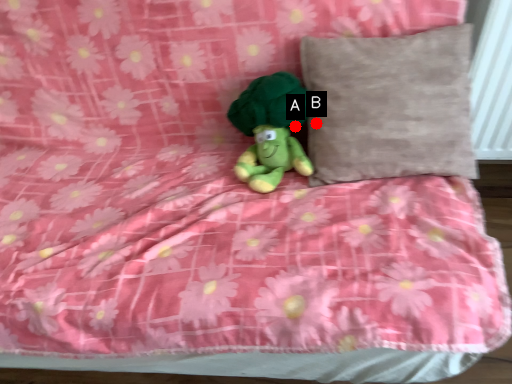
Question: Two points are circled on the image, labeled by A and B beside each circle. Which of the following is the closest to the observer?

Choices:
 (A) A is closer
 (B) B is closer

Answer: (B)